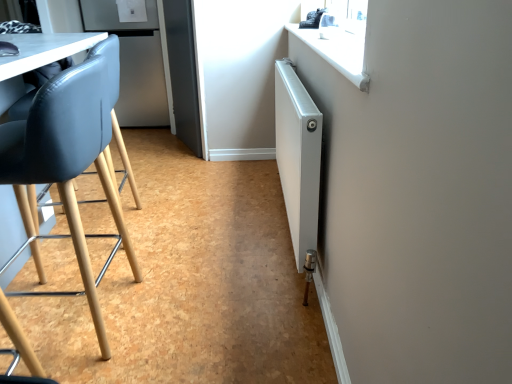
Where is `free spot behind white metallic radiator at right`? The width and height of the screenshot is (512, 384). free spot behind white metallic radiator at right is located at coordinates (231, 183).